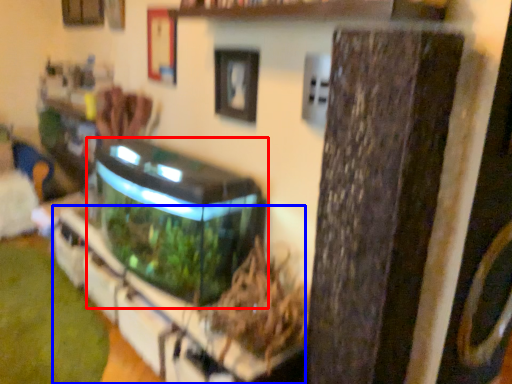
Question: Which object is closer to the camera taking this photo, water tank (highlighted by a red box) or shelf (highlighted by a blue box)?

Choices:
 (A) water tank
 (B) shelf

Answer: (B)